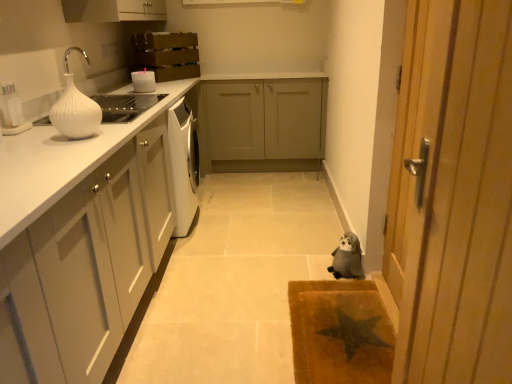
Find the location of `empty space that is to the right of white glossy knife block at upper left, acting as the 2th appliance starting from the right`. empty space that is to the right of white glossy knife block at upper left, acting as the 2th appliance starting from the right is located at coordinates (37, 132).